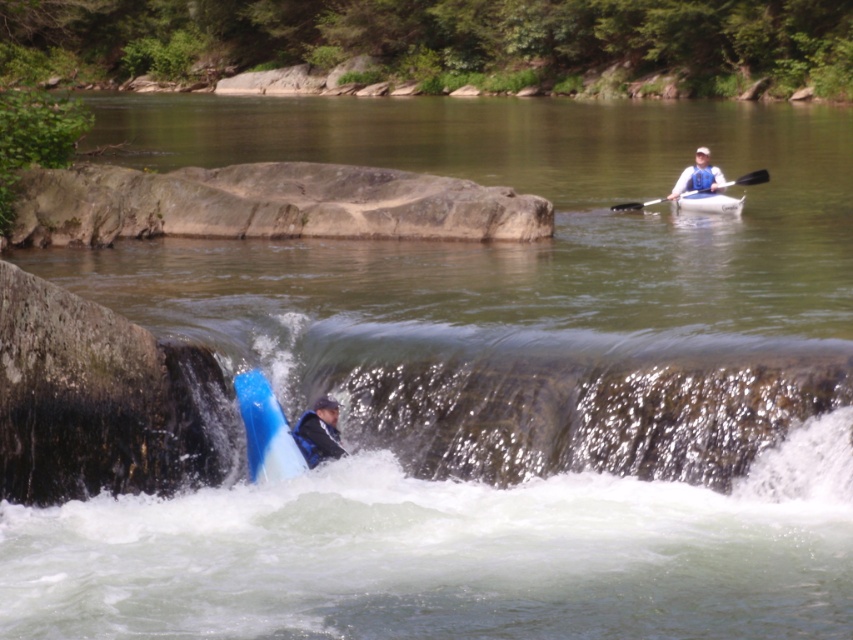
Question: Which point is farther to the camera?

Choices:
 (A) blue rubber kayak at lower left
 (B) blue plastic kayak at upper right
 (C) black plastic paddle at upper right
 (D) blue glossy kayak at lower center

Answer: (C)

Question: Is blue glossy kayak at lower center above blue rubber kayak at lower left?

Choices:
 (A) yes
 (B) no

Answer: (A)

Question: Among these points, which one is nearest to the camera?

Choices:
 (A) (318, 442)
 (B) (688, 168)
 (C) (735, 212)

Answer: (A)

Question: Is blue glossy kayak at lower center to the right of black plastic paddle at upper right from the viewer's perspective?

Choices:
 (A) yes
 (B) no

Answer: (B)

Question: Can you confirm if white rubber canoe at upper center is thinner than black plastic paddle at upper right?

Choices:
 (A) yes
 (B) no

Answer: (A)

Question: Which of these objects is positioned closest to the blue glossy kayak at lower center?

Choices:
 (A) white rubber canoe at upper center
 (B) blue rubber kayak at lower left
 (C) blue plastic kayak at upper right

Answer: (B)